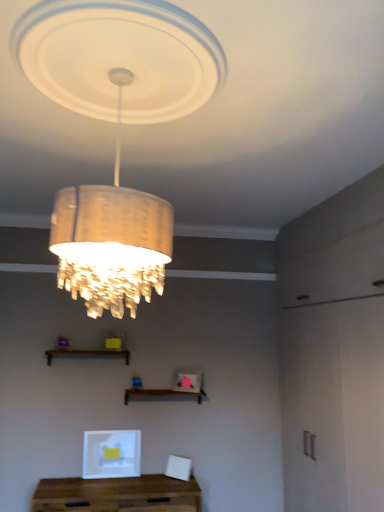
Question: Is brown wooden shelf at center, the second shelf from the left, taller than wooden shelf at lower center, acting as the 1th shelf starting from the top?

Choices:
 (A) no
 (B) yes

Answer: (B)

Question: Is brown wooden shelf at center, marked as the 2th shelf in a top-to-bottom arrangement, surrounding wooden shelf at lower center, positioned as the 1th shelf in left-to-right order?

Choices:
 (A) yes
 (B) no

Answer: (B)

Question: Is brown wooden shelf at center, the second shelf from the left, turned away from wooden shelf at lower center, acting as the 1th shelf starting from the top?

Choices:
 (A) yes
 (B) no

Answer: (B)

Question: From the image's perspective, is brown wooden shelf at center, marked as the 1th shelf in a bottom-to-top arrangement, under wooden shelf at lower center, acting as the 1th shelf starting from the top?

Choices:
 (A) no
 (B) yes

Answer: (B)

Question: Is brown wooden shelf at center, the 1th shelf when ordered from right to left, at the right side of wooden shelf at lower center, acting as the 1th shelf starting from the top?

Choices:
 (A) yes
 (B) no

Answer: (A)

Question: Is wooden table at lower center taller or shorter than brown wooden shelf at center, marked as the 2th shelf in a top-to-bottom arrangement?

Choices:
 (A) short
 (B) tall

Answer: (B)

Question: Which is correct: wooden table at lower center is inside brown wooden shelf at center, the second shelf from the left, or outside of it?

Choices:
 (A) outside
 (B) inside

Answer: (A)

Question: From the image's perspective, is wooden table at lower center located above or below brown wooden shelf at center, the second shelf from the left?

Choices:
 (A) above
 (B) below

Answer: (B)

Question: From a real-world perspective, is wooden table at lower center above or below brown wooden shelf at center, the second shelf from the left?

Choices:
 (A) below
 (B) above

Answer: (A)

Question: From the image's perspective, is wooden shelf at lower center, the 2th shelf positioned from the right, positioned above or below brown wooden shelf at center, the second shelf from the left?

Choices:
 (A) above
 (B) below

Answer: (A)

Question: Is wooden shelf at lower center, the 2th shelf when ordered from bottom to top, in front of or behind brown wooden shelf at center, the second shelf from the left, in the image?

Choices:
 (A) behind
 (B) front

Answer: (B)

Question: Based on their positions, is wooden shelf at lower center, the 2th shelf positioned from the right, located to the left or right of brown wooden shelf at center, the second shelf from the left?

Choices:
 (A) right
 (B) left

Answer: (B)

Question: In terms of width, does wooden shelf at lower center, positioned as the 1th shelf in left-to-right order, look wider or thinner when compared to brown wooden shelf at center, the 1th shelf when ordered from right to left?

Choices:
 (A) wide
 (B) thin

Answer: (B)

Question: Considering the positions of point (168, 394) and point (94, 17), is point (168, 394) closer or farther from the camera than point (94, 17)?

Choices:
 (A) closer
 (B) farther

Answer: (B)

Question: From the image's perspective, relative to matte gold chandelier at upper center, is brown wooden shelf at center, marked as the 2th shelf in a top-to-bottom arrangement, above or below?

Choices:
 (A) below
 (B) above

Answer: (A)